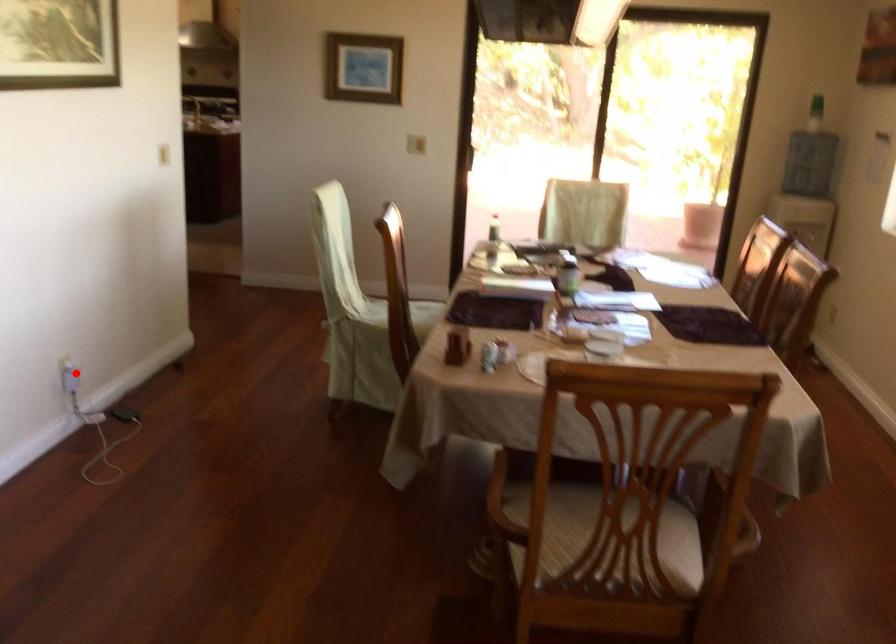
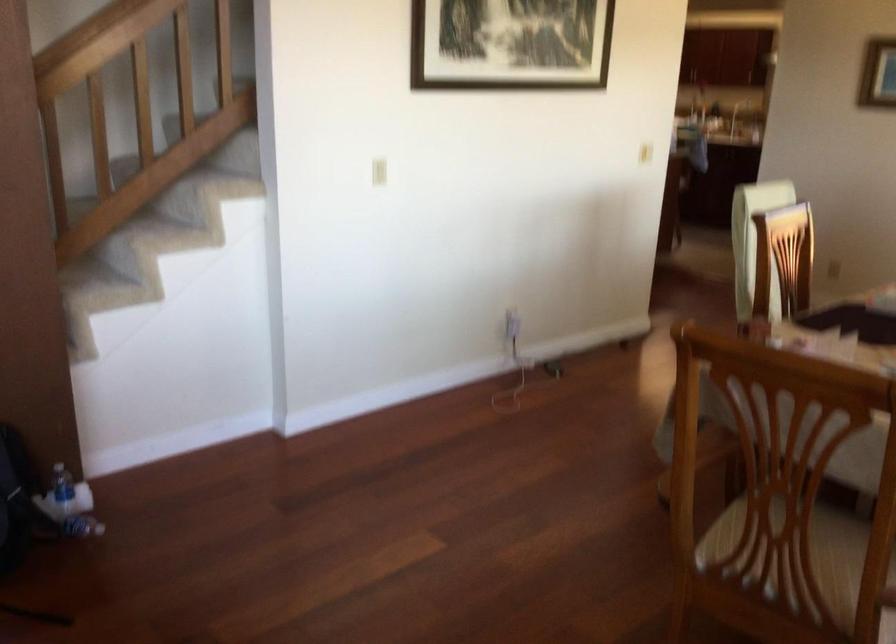
Question: I am providing you with two images of the same scene from different viewpoints. Image1 has a red point marked. In image2, the corresponding 3D location appears at what relative position? Reply with the corresponding letter.

Choices:
 (A) Closer
 (B) Farther

Answer: (B)